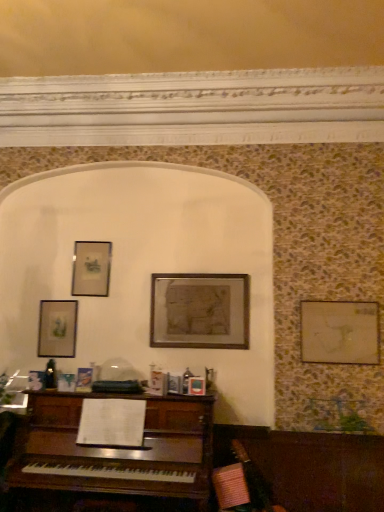
Question: Considering the positions of matte silver picture frame at upper left, the second picture frame from the left, and matte glass picture frame at upper left, which ranks as the 4th picture frame in right-to-left order, in the image, is matte silver picture frame at upper left, the second picture frame from the left, wider or thinner than matte glass picture frame at upper left, which ranks as the 4th picture frame in right-to-left order,?

Choices:
 (A) wide
 (B) thin

Answer: (B)

Question: From their relative heights in the image, would you say matte silver picture frame at upper left, placed as the third picture frame when sorted from right to left, is taller or shorter than matte glass picture frame at upper left, arranged as the 1th picture frame when viewed from the left?

Choices:
 (A) tall
 (B) short

Answer: (B)

Question: Estimate the real-world distances between objects in this image. Which object is closer to the matte glass picture frame at upper left, arranged as the 1th picture frame when viewed from the left?

Choices:
 (A) wooden framed map at center, which is counted as the 3th picture frame, starting from the left
 (B) matte silver picture frame at upper left, placed as the third picture frame when sorted from right to left
 (C) wooden picture frame at right, which is counted as the 1th picture frame, starting from the right

Answer: (B)

Question: Based on their relative distances, which object is farther from the wooden picture frame at right, which is counted as the 1th picture frame, starting from the right?

Choices:
 (A) matte glass picture frame at upper left, which ranks as the 4th picture frame in right-to-left order
 (B) matte silver picture frame at upper left, placed as the third picture frame when sorted from right to left
 (C) wooden framed map at center, which is counted as the 3th picture frame, starting from the left

Answer: (A)